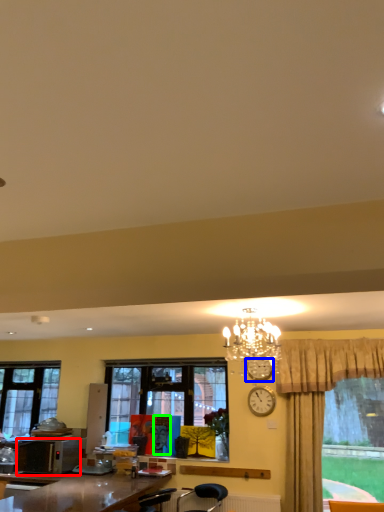
Question: Which is nearer to the microwave oven (highlighted by a red box)? clock (highlighted by a blue box) or person (highlighted by a green box).

Choices:
 (A) clock
 (B) person

Answer: (B)